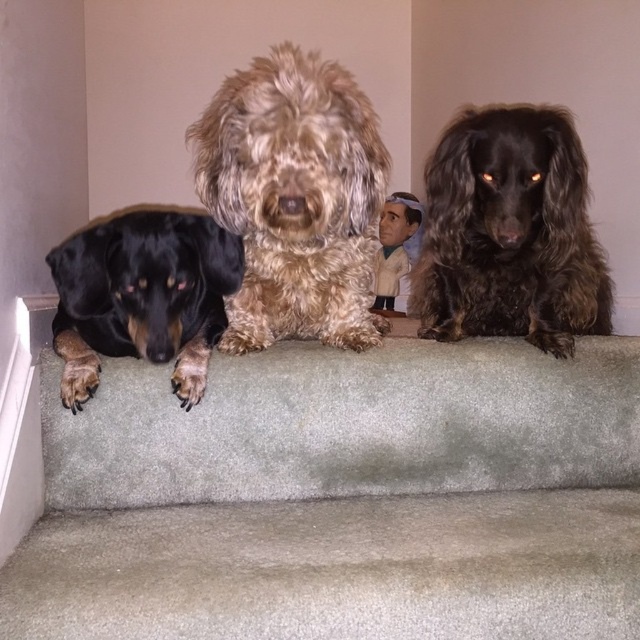
Between carpeted stairs at center and shiny brown fur at center, which one has less height?

Standing shorter between the two is carpeted stairs at center.

What do you see at coordinates (342, 497) in the screenshot? I see `carpeted stairs at center` at bounding box center [342, 497].

Is point (570, 525) closer to camera compared to point (460, 182)?

That is True.

Locate an element on the screen. The image size is (640, 640). carpeted stairs at center is located at coordinates (342, 497).

What do you see at coordinates (342, 497) in the screenshot?
I see `carpeted stairs at center` at bounding box center [342, 497].

Can you confirm if carpeted stairs at center is bigger than fuzzy brown dog at center?

Correct, carpeted stairs at center is larger in size than fuzzy brown dog at center.

This screenshot has width=640, height=640. Describe the element at coordinates (342, 497) in the screenshot. I see `carpeted stairs at center` at that location.

Where is `carpeted stairs at center`? carpeted stairs at center is located at coordinates (342, 497).

Consider the image. Is fuzzy brown dog at center closer to the viewer compared to black matte dog at left?

Yes.

How far apart are fuzzy brown dog at center and black matte dog at left?

fuzzy brown dog at center is 6.73 inches away from black matte dog at left.

Who is more forward, (275, 124) or (202, 230)?

Point (275, 124) is in front.

I want to click on fuzzy brown dog at center, so click(294, 198).